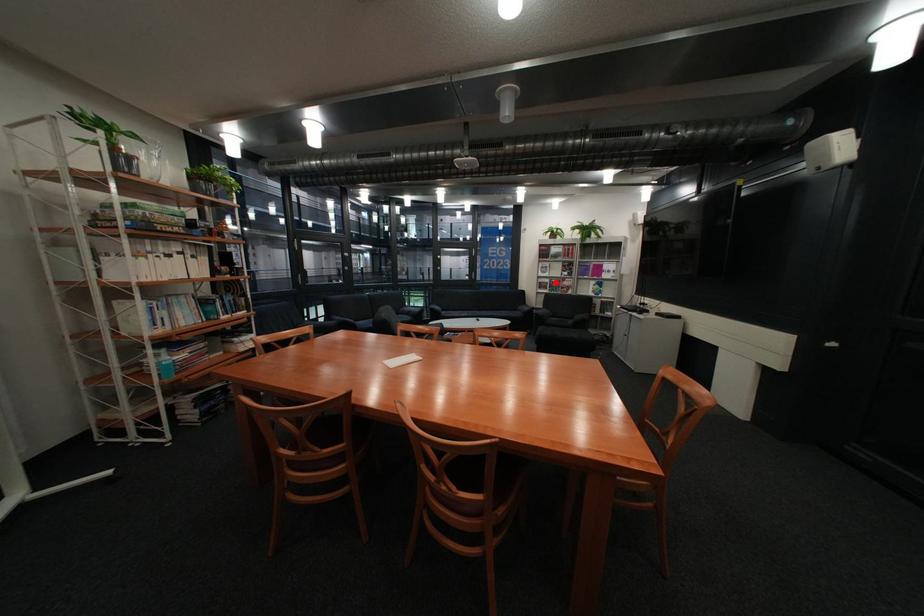
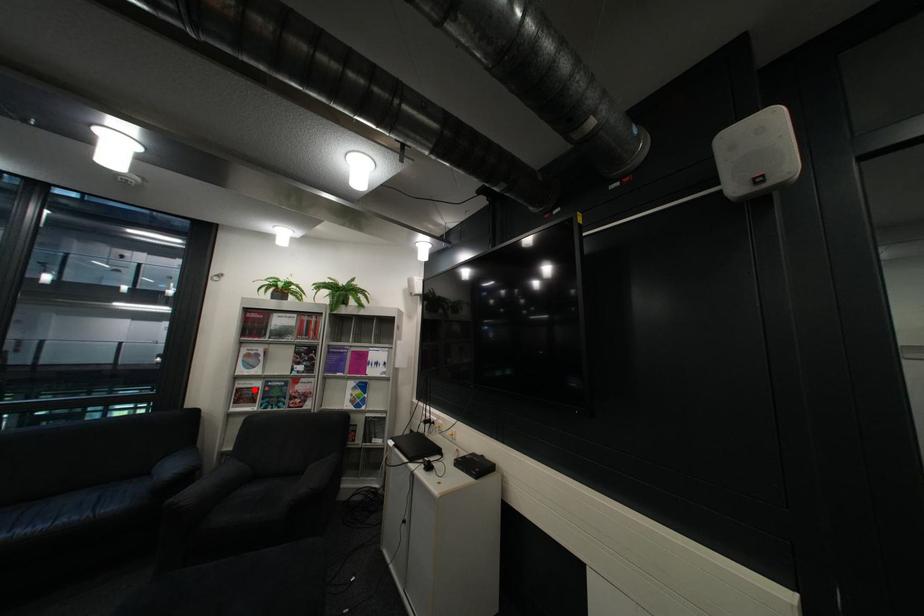
I am providing you with two images of the same scene from different viewpoints. A red point is marked on the first image and another point is marked on the second image. Is the red point in image1 aligned with the point shown in image2?

Yes